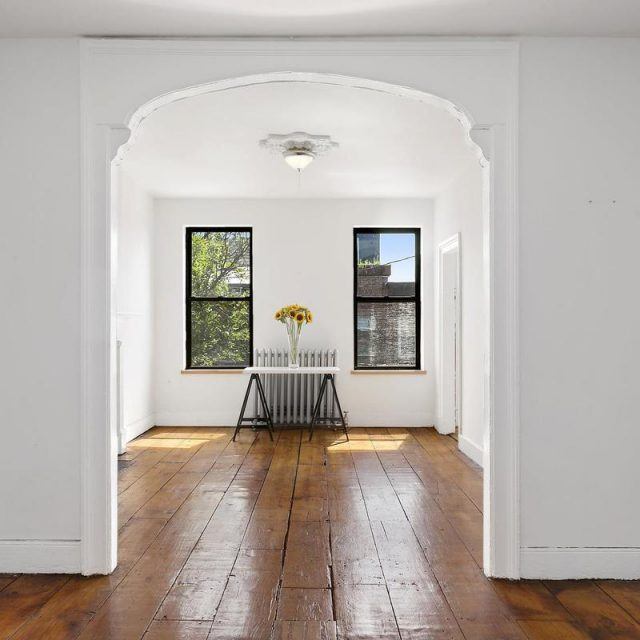
The height and width of the screenshot is (640, 640). I want to click on windows, so click(x=218, y=324), click(x=380, y=332), click(x=387, y=265), click(x=210, y=271).